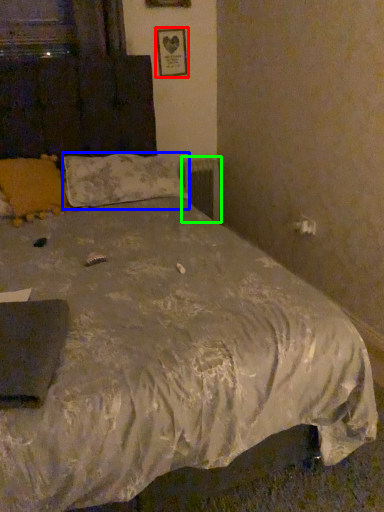
Question: Estimate the real-world distances between objects in this image. Which object is closer to picture frame (highlighted by a red box), pillow (highlighted by a blue box) or radiator (highlighted by a green box)?

Choices:
 (A) pillow
 (B) radiator

Answer: (B)